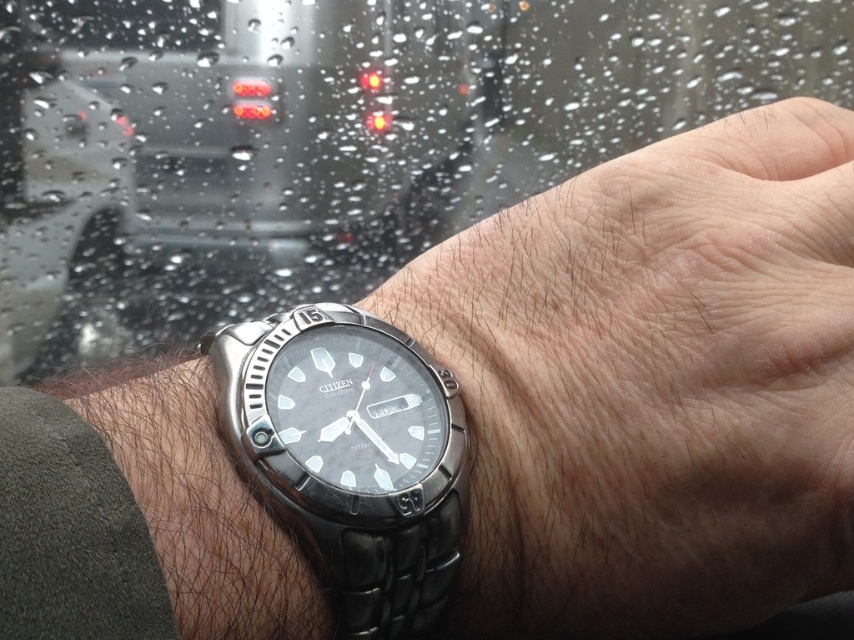
Between point (217, 230) and point (268, 493), which one is positioned behind?

The point (217, 230) is behind.

Measure the distance between satin silver watch at lower left and satin silver watch at center.

The distance of satin silver watch at lower left from satin silver watch at center is 21.46 inches.

Locate an element on the screen. This screenshot has height=640, width=854. satin silver watch at lower left is located at coordinates (223, 140).

Find the location of a particular element. This screenshot has width=854, height=640. satin silver watch at lower left is located at coordinates (223, 140).

Who is positioned more to the left, metallic wristwatch at center or satin silver watch at center?

From the viewer's perspective, satin silver watch at center appears more on the left side.

Does metallic wristwatch at center have a greater height compared to satin silver watch at center?

Yes, metallic wristwatch at center is taller than satin silver watch at center.

The width and height of the screenshot is (854, 640). I want to click on metallic wristwatch at center, so click(x=654, y=384).

Who is more forward, (778, 236) or (331, 148)?

Point (778, 236) is in front.

Which is more to the left, metallic wristwatch at center or satin silver watch at lower left?

Positioned to the left is satin silver watch at lower left.

Between point (812, 244) and point (127, 26), which one is positioned in front?

Point (812, 244)

The width and height of the screenshot is (854, 640). Find the location of `metallic wristwatch at center`. metallic wristwatch at center is located at coordinates (654, 384).